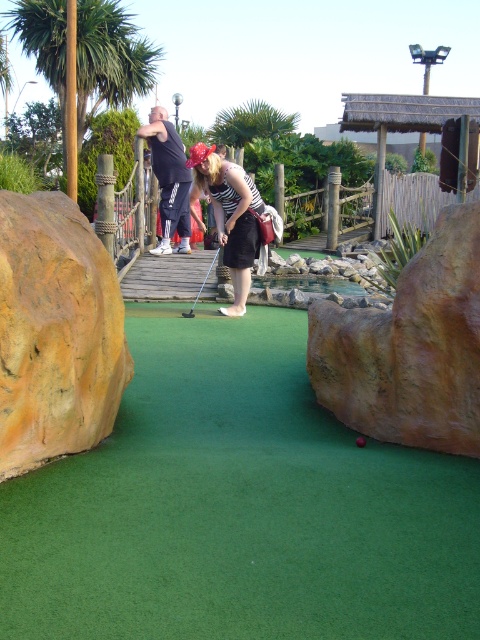
How far apart are dark blue track pants at center and smooth red golf ball at center?

6.19 meters

Locate an element on the screen. dark blue track pants at center is located at coordinates (x=168, y=179).

Is striped fabric shirt at center thinner than smooth red golf ball at center?

No, striped fabric shirt at center is not thinner than smooth red golf ball at center.

The image size is (480, 640). I want to click on striped fabric shirt at center, so click(x=229, y=216).

This screenshot has width=480, height=640. Identify the location of striped fabric shirt at center. (229, 216).

Who is more distant from viewer, [217,177] or [180,202]?

The point [180,202] is behind.

Who is higher up, striped fabric shirt at center or dark blue track pants at center?

Positioned higher is dark blue track pants at center.

Which is in front, point (232, 259) or point (142, 125)?

Positioned in front is point (232, 259).

The image size is (480, 640). I want to click on striped fabric shirt at center, so click(229, 216).